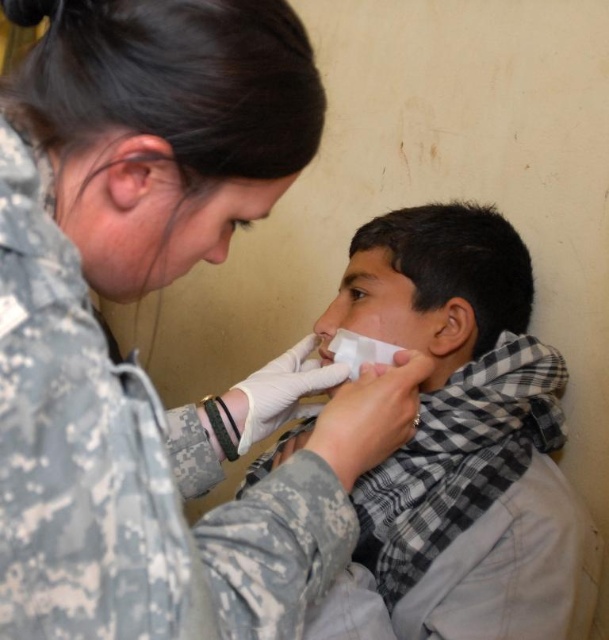
Question: Is camouflage uniform at center above white checkered scarf at center?

Choices:
 (A) yes
 (B) no

Answer: (A)

Question: Which object is farther from the camera taking this photo?

Choices:
 (A) camouflage uniform at center
 (B) white checkered scarf at center

Answer: (B)

Question: Does camouflage uniform at center lie in front of white checkered scarf at center?

Choices:
 (A) yes
 (B) no

Answer: (A)

Question: Is camouflage uniform at center to the left of white checkered scarf at center from the viewer's perspective?

Choices:
 (A) yes
 (B) no

Answer: (A)

Question: Which point is farther to the camera?

Choices:
 (A) white checkered scarf at center
 (B) camouflage uniform at center

Answer: (A)

Question: Which point appears farthest from the camera in this image?

Choices:
 (A) (381, 216)
 (B) (15, 321)

Answer: (A)